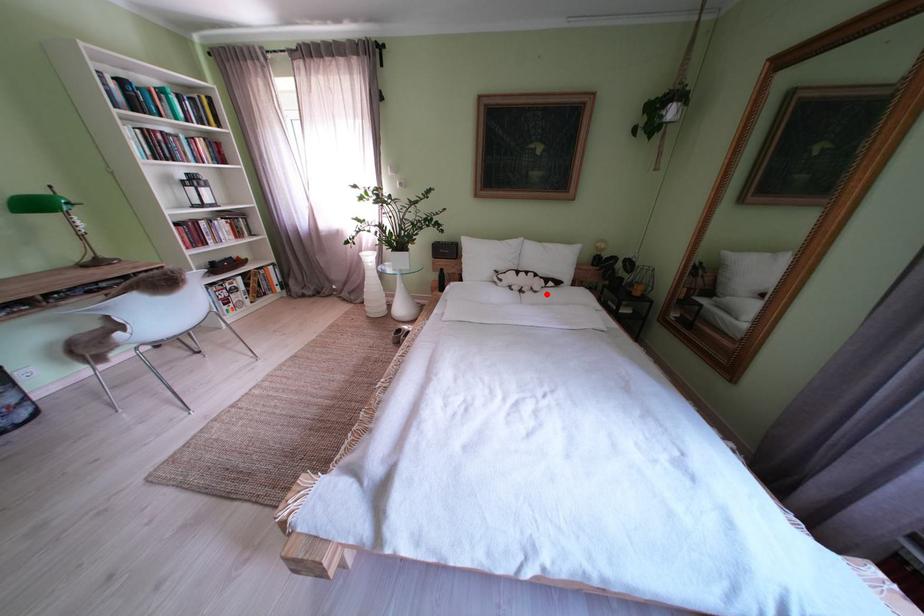
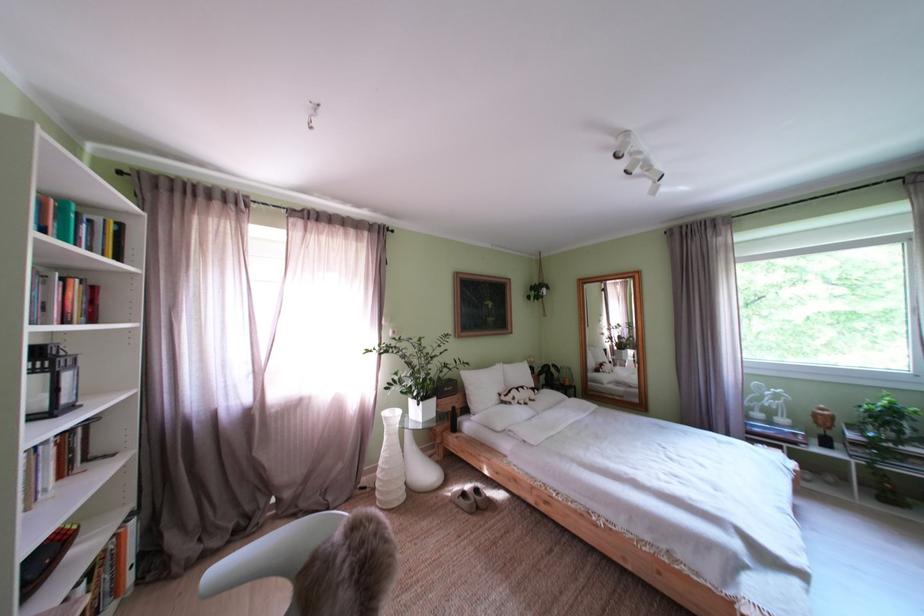
Where in the second image is the point corresponding to the highlighted location from the first image?

(543, 403)